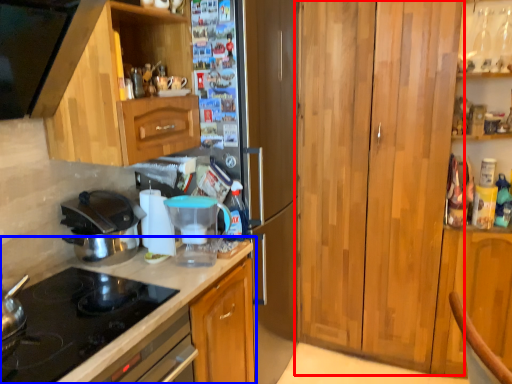
Question: Which object is closer to the camera taking this photo, cabinetry (highlighted by a red box) or countertop (highlighted by a blue box)?

Choices:
 (A) cabinetry
 (B) countertop

Answer: (B)